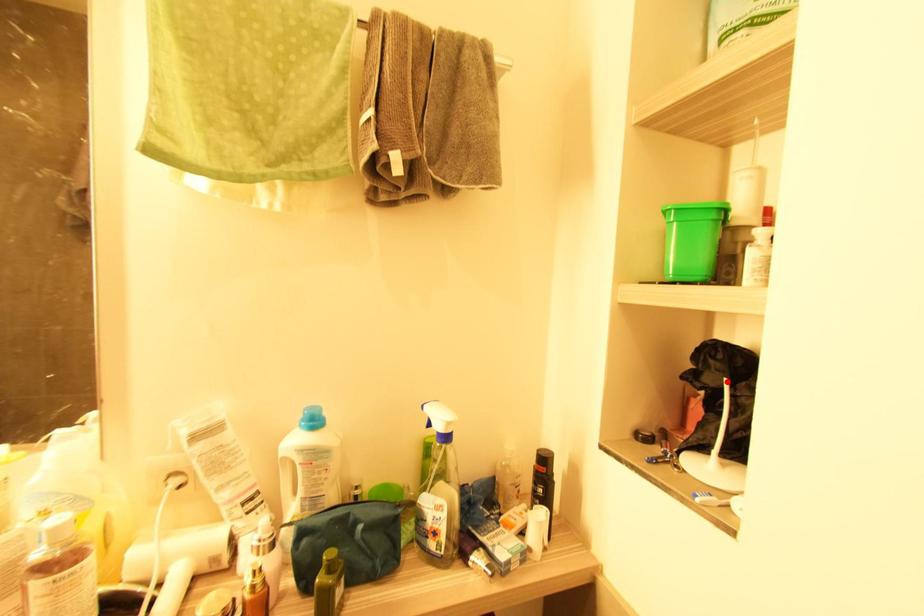
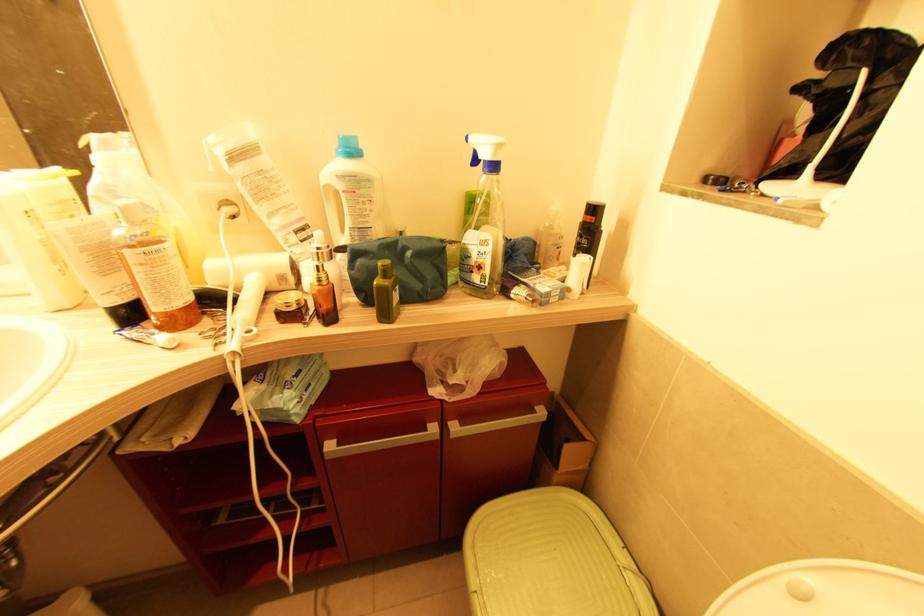
Locate, in the second image, the point that corresponds to the highlighted location in the first image.

(867, 73)